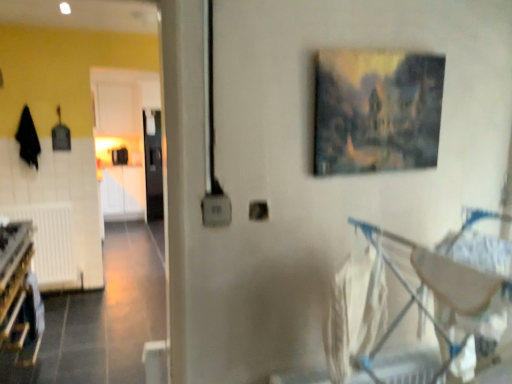
Question: Looking at the image, does metallic silver baby carriage at lower right seem bigger or smaller compared to white fabric laundry at lower right?

Choices:
 (A) big
 (B) small

Answer: (A)

Question: Does point pyautogui.click(x=443, y=364) appear closer or farther from the camera than point pyautogui.click(x=352, y=274)?

Choices:
 (A) farther
 (B) closer

Answer: (A)

Question: Estimate the real-world distances between objects in this image. Which object is farther from the wooden bunk bed at lower left?

Choices:
 (A) metallic silver baby carriage at lower right
 (B) oil painting at upper center
 (C) white fabric laundry at lower right
 (D) transparent glass door at center
 (E) white matte radiator at lower left

Answer: (D)

Question: Considering the real-world distances, which object is closest to the transparent glass door at center?

Choices:
 (A) metallic silver baby carriage at lower right
 (B) white matte radiator at lower left
 (C) white fabric laundry at lower right
 (D) oil painting at upper center
 (E) wooden bunk bed at lower left

Answer: (B)